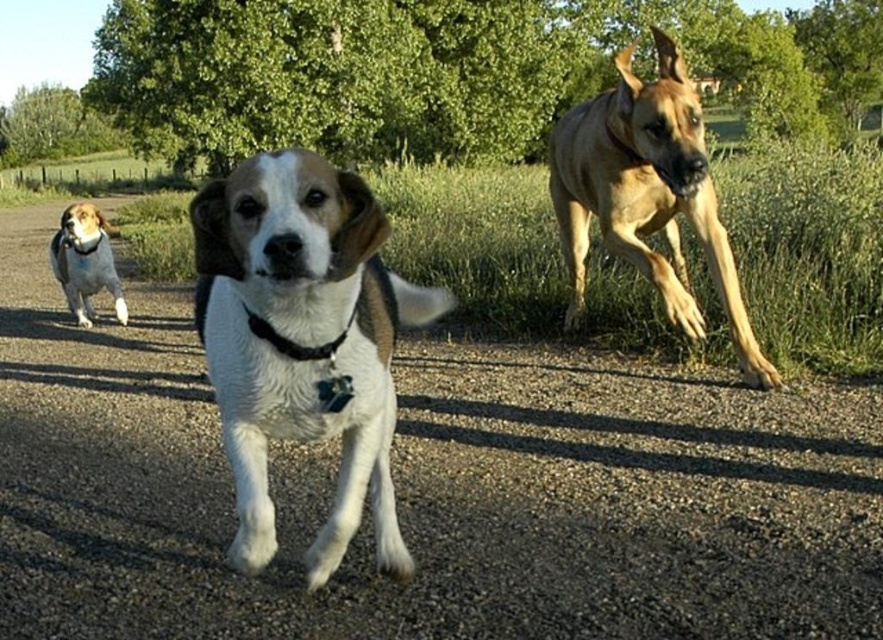
You are a photographer trying to capture the beagle in the foreground and the Great Dane in the background. You want to adjust your camera focus so that both dogs are in focus. The beagle is at point [95,266] and the Great Dane is at point [296,358]. Which point should you focus on to ensure both are sharp?

You should focus on point [95,266] because it is closer to you than point [296,358]. This will ensure the beagle is in focus, and due to depth of field, the Great Dane further back may also be acceptably sharp.

You are a photographer trying to capture the white fur dog at center and the black leather neckband at center in a single shot. Based on their sizes in the image, which one would appear larger in your photo?

The white fur dog at center appears larger in the photo because it has a greater height compared to the black leather neckband at center.

You are standing at the starting point and see two points marked in the image. The first point is at coordinates point (334, 202) and the second point is at point (308, 352). Which of these points is closer to you?

Point (334, 202) is in front of point (308, 352), so it is closer to you.